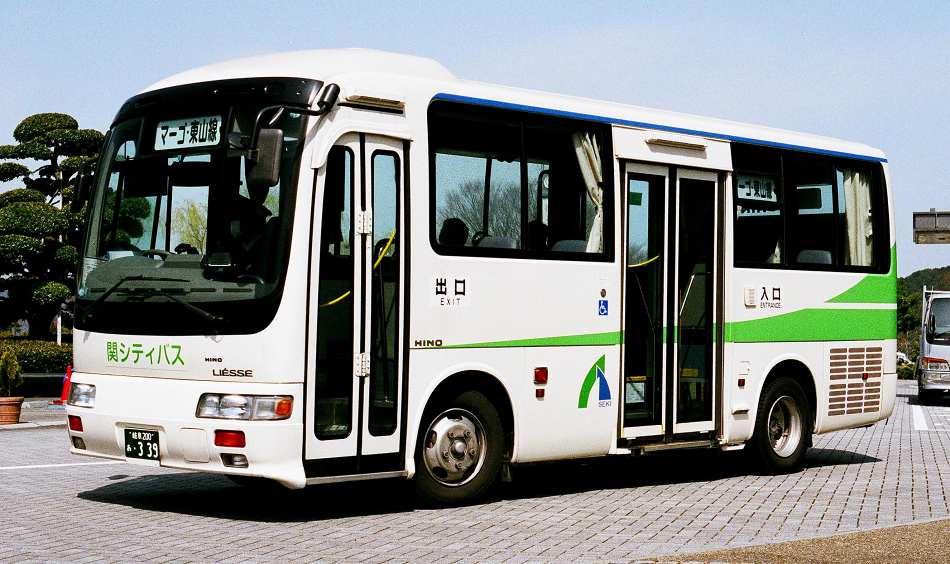
Locate an element on the screen. This screenshot has height=564, width=950. white curtain is located at coordinates (592, 173).